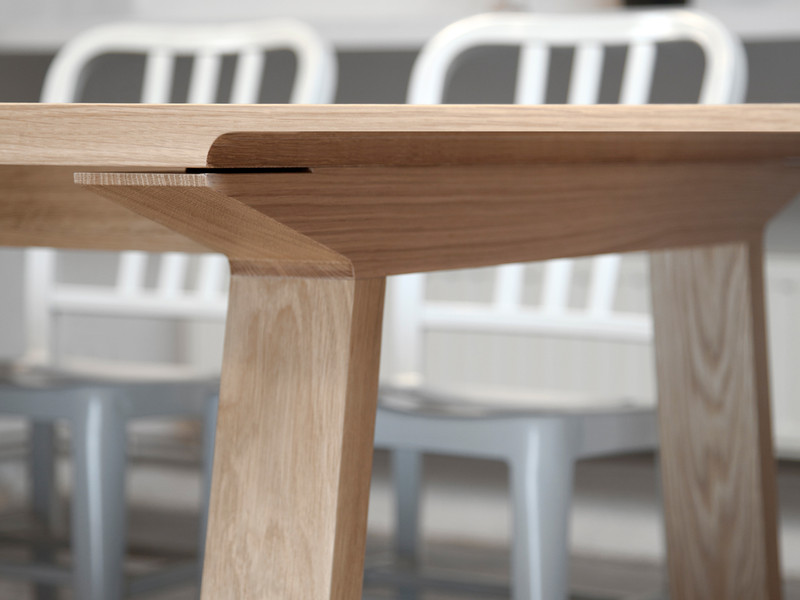
Locate an element on the screen. table leg is located at coordinates (270, 417), (692, 375).